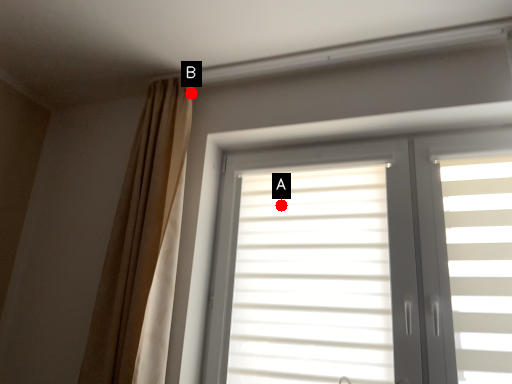
Question: Two points are circled on the image, labeled by A and B beside each circle. Which of the following is the farthest from the observer?

Choices:
 (A) A is further
 (B) B is further

Answer: (B)